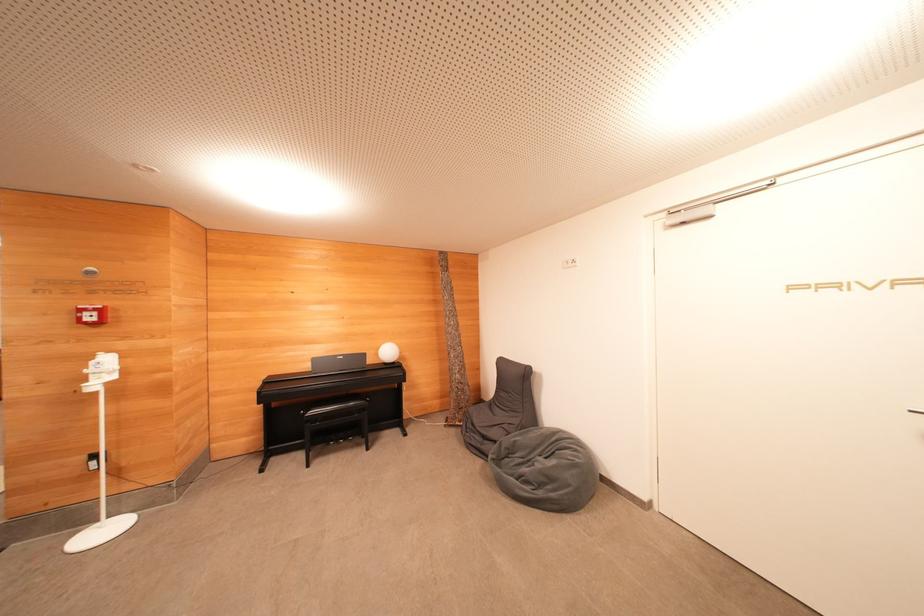
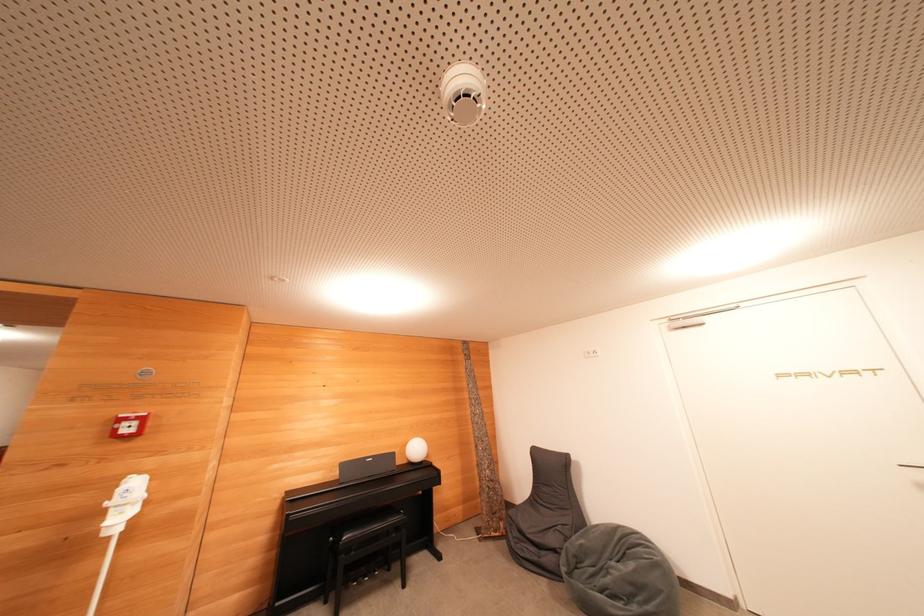
Where in the second image is the point corresponding to point 99,317 from the first image?

(139, 427)